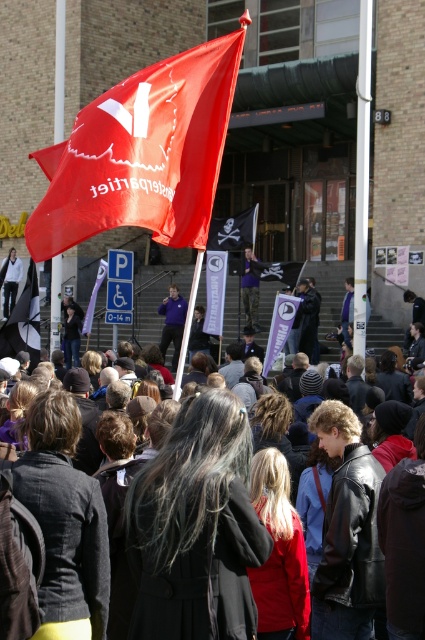
Question: Among these points, which one is nearest to the camera?

Choices:
 (A) (340, 436)
 (B) (87, 323)
 (C) (207, 285)

Answer: (A)

Question: Is black and white fabric flag at left positioned before matte purple banner at center?

Choices:
 (A) no
 (B) yes

Answer: (B)

Question: Estimate the real-world distances between objects in this image. Which object is farther from the black fabric flag at center?

Choices:
 (A) black pirate flag at center
 (B) purple fabric at center

Answer: (B)

Question: Does matte black jacket at lower left appear under black pirate flag at center?

Choices:
 (A) yes
 (B) no

Answer: (B)

Question: Among these objects, which one is farthest from the camera?

Choices:
 (A) red fabric flag at center
 (B) red fabric flag at upper left

Answer: (A)

Question: Considering the relative positions of red fabric flag at upper left and matte black jacket at lower left in the image provided, where is red fabric flag at upper left located with respect to matte black jacket at lower left?

Choices:
 (A) above
 (B) below

Answer: (B)